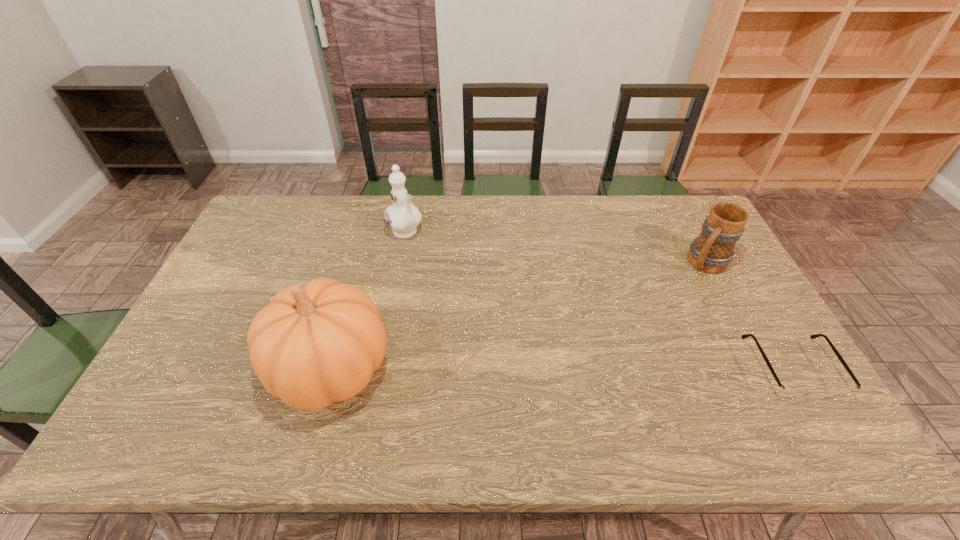
Where is `vacant area situated 0.130m at the spout of the chinaware`? The image size is (960, 540). vacant area situated 0.130m at the spout of the chinaware is located at coordinates 431,267.

You are a GUI agent. You are given a task and a screenshot of the screen. Output one action in this format:
    pyautogui.click(x=<x>, y=<y>)
    Task: Click on the free space located 0.120m at the spout of the chinaware
    This screenshot has height=540, width=960.
    Given the screenshot: What is the action you would take?
    pyautogui.click(x=429, y=266)

Identify the location of object positioned at the far edge. Image resolution: width=960 pixels, height=540 pixels. (402, 217).

You are a GUI agent. You are given a task and a screenshot of the screen. Output one action in this format:
    pyautogui.click(x=<x>, y=<y>)
    Task: Click on the pumpkin at the near edge
    The width and height of the screenshot is (960, 540).
    Given the screenshot: What is the action you would take?
    pyautogui.click(x=315, y=344)

The image size is (960, 540). Identify the location of spectacles at the near edge. (785, 392).

Locate an element on the screen. Image resolution: width=960 pixels, height=540 pixels. spectacles that is at the right edge is located at coordinates (785, 392).

Identify the location of mug that is positioned at the right edge. This screenshot has height=540, width=960. (712, 251).

Locate an element on the screen. The height and width of the screenshot is (540, 960). object situated at the near right corner is located at coordinates (785, 392).

I want to click on vacant space at the far edge, so click(461, 199).

I want to click on vacant region at the near edge of the desktop, so click(x=371, y=379).